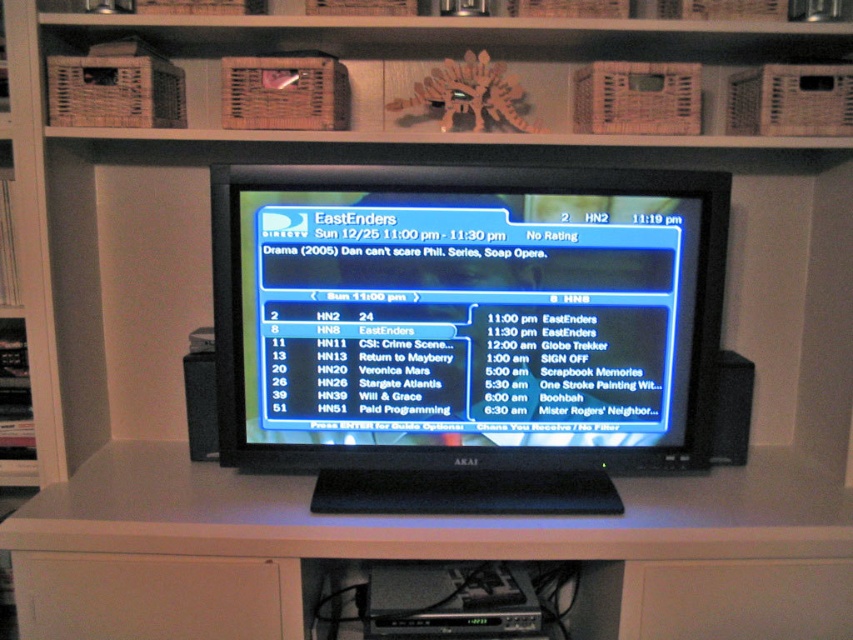
You are setting up a new speaker system and want to place it next to the existing black plastic speaker at left. The new speaker is 10 cm taller than the existing one. Will the new speaker fit vertically without exceeding the height of the matte plastic tv screen at center?

The matte plastic tv screen at center is taller than the black plastic speaker at left. Since the new speaker is only 10 cm taller than the existing black plastic speaker at left, it depends on the exact dimensions. However, since the TV screen is already taller than the current speaker, there is a possibility the new speaker could fit if its total height remains under the TV screen.

You are organizing a living room and need to place a new speaker that is 15 cm wide. You have the wooden at upper center and the black plastic speaker at right. Which object can accommodate the new speaker without exceeding its width?

The wooden at upper center is larger in size than the black plastic speaker at right, so the new speaker can fit on the wooden at upper center.